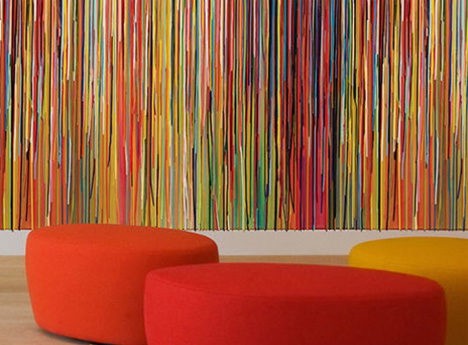
I want to click on orange ottoman, so click(x=91, y=286).